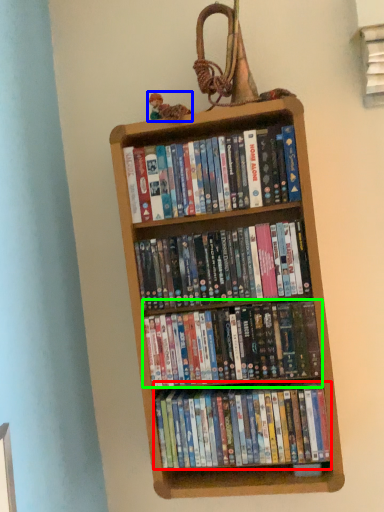
Question: Which is farther away from book (highlighted by a red box)? toy (highlighted by a blue box) or book (highlighted by a green box)?

Choices:
 (A) toy
 (B) book

Answer: (A)